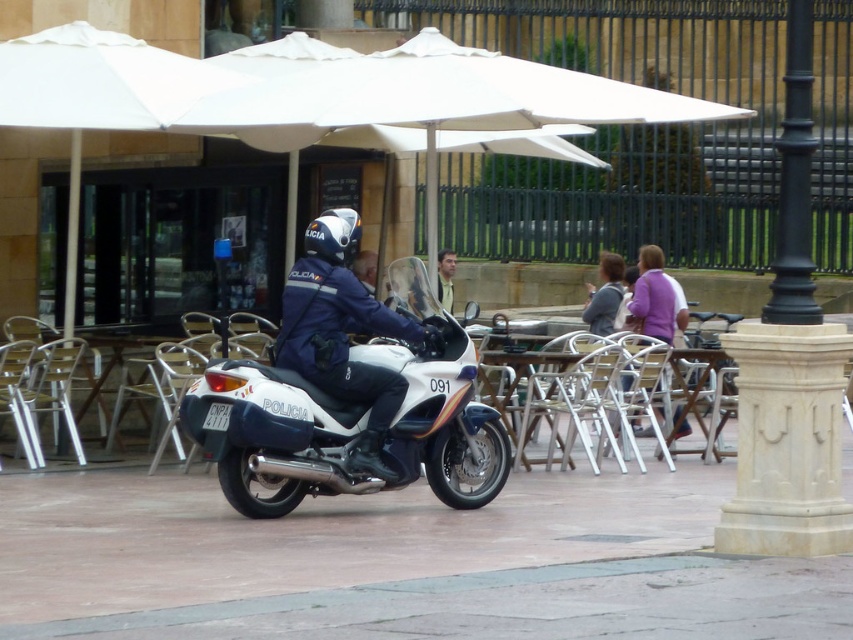
Who is taller, blue fabric uniform at center or purple sweater at center?

With more height is blue fabric uniform at center.

This screenshot has width=853, height=640. Identify the location of blue fabric uniform at center. coord(343,333).

The height and width of the screenshot is (640, 853). Identify the location of metallic silver chair at left. (45, 390).

This screenshot has height=640, width=853. What do you see at coordinates (45, 390) in the screenshot?
I see `metallic silver chair at left` at bounding box center [45, 390].

At what (x,y) coordinates should I click in order to perform the action: click on metallic silver chair at left. Please return your answer as a coordinate pair (x, y). The image size is (853, 640). Looking at the image, I should click on (45, 390).

Between white glossy motorcycle at center and blue fabric uniform at center, which one appears on the right side from the viewer's perspective?

From the viewer's perspective, blue fabric uniform at center appears more on the right side.

Which of these two, white glossy motorcycle at center or blue fabric uniform at center, stands shorter?

With less height is white glossy motorcycle at center.

Who is more forward, (485,440) or (328,321)?

Point (328,321) is in front.

I want to click on white glossy motorcycle at center, so click(x=352, y=417).